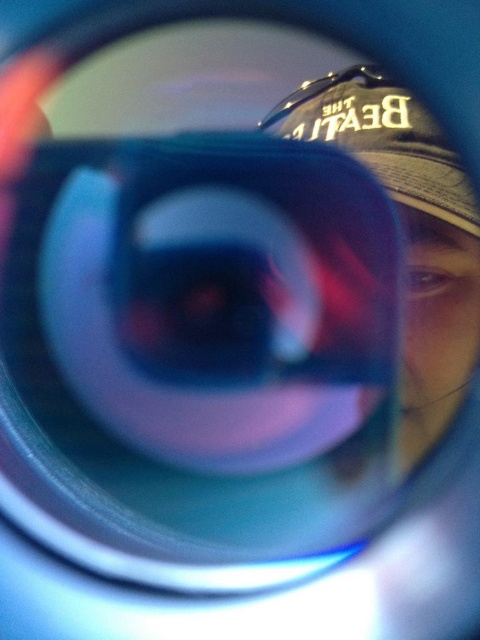
Looking at this image, you are holding a transparent plastic magnifying glass at center and a matte black baseball cap at upper right. Which object is positioned more towards the left side of the image?

The transparent plastic magnifying glass at center is positioned to the left of the matte black baseball cap at upper right, so it is more towards the left side of the image.

You are holding a magnifying glass and looking through a camera lens. There is a point at coordinates (x=225, y=298). What object is located at that point?

The point at coordinates (x=225, y=298) corresponds to the transparent plastic magnifying glass at center.